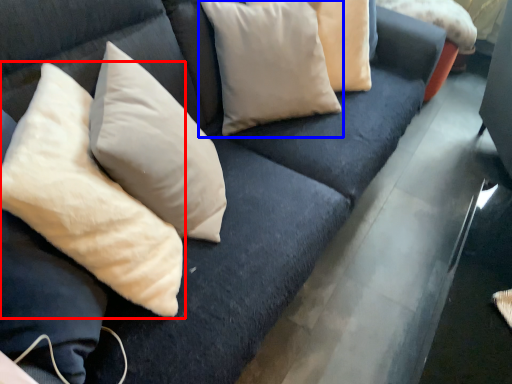
Question: Among these objects, which one is nearest to the camera, pillow (highlighted by a red box) or pillow (highlighted by a blue box)?

Choices:
 (A) pillow
 (B) pillow

Answer: (A)